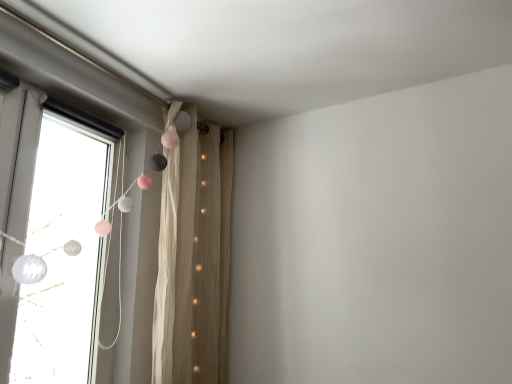
Question: Considering the relative sizes of white matte curtain at left and beige textured curtain at upper left in the image provided, is white matte curtain at left thinner than beige textured curtain at upper left?

Choices:
 (A) yes
 (B) no

Answer: (A)

Question: Is white matte curtain at left far away from beige textured curtain at upper left?

Choices:
 (A) yes
 (B) no

Answer: (B)

Question: From a real-world perspective, is white matte curtain at left physically below beige textured curtain at upper left?

Choices:
 (A) yes
 (B) no

Answer: (B)

Question: Is white matte curtain at left bigger than beige textured curtain at upper left?

Choices:
 (A) yes
 (B) no

Answer: (A)

Question: Is white matte curtain at left wider than beige textured curtain at upper left?

Choices:
 (A) no
 (B) yes

Answer: (A)

Question: Does white matte curtain at left appear on the right side of beige textured curtain at upper left?

Choices:
 (A) no
 (B) yes

Answer: (A)

Question: Is beige textured curtain at upper left thinner than white matte curtain at left?

Choices:
 (A) no
 (B) yes

Answer: (A)

Question: From the image's perspective, is beige textured curtain at upper left above white matte curtain at left?

Choices:
 (A) no
 (B) yes

Answer: (A)

Question: Is white matte curtain at left located within beige textured curtain at upper left?

Choices:
 (A) yes
 (B) no

Answer: (B)

Question: From the image's perspective, is beige textured curtain at upper left below white matte curtain at left?

Choices:
 (A) yes
 (B) no

Answer: (A)

Question: Is beige textured curtain at upper left aimed at white matte curtain at left?

Choices:
 (A) yes
 (B) no

Answer: (B)

Question: Can you confirm if beige textured curtain at upper left is shorter than white matte curtain at left?

Choices:
 (A) no
 (B) yes

Answer: (A)

Question: Considering their positions, is beige textured curtain at upper left located in front of or behind white matte curtain at left?

Choices:
 (A) front
 (B) behind

Answer: (B)